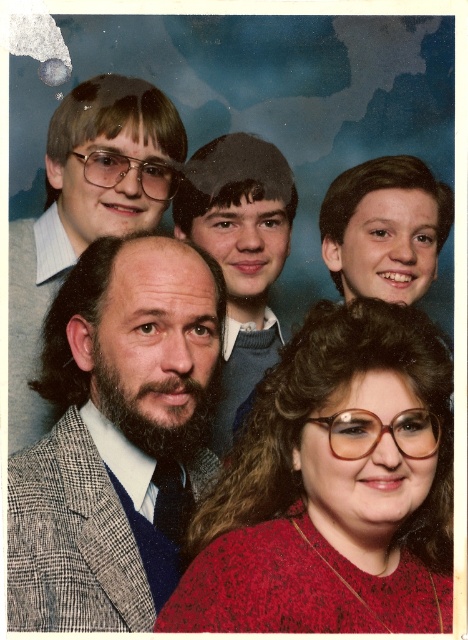
Where is the gray checkered suit at center located in the image?

The gray checkered suit at center is located at point [110,428].